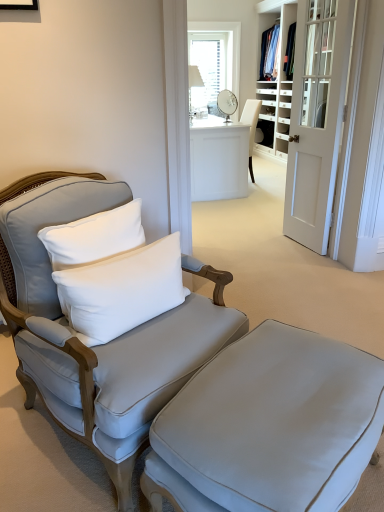
Find the location of `satin gray armchair at left`. satin gray armchair at left is located at coordinates (95, 345).

The width and height of the screenshot is (384, 512). Describe the element at coordinates (231, 42) in the screenshot. I see `white glass window at upper center` at that location.

This screenshot has width=384, height=512. Identify the location of matte gray ottoman at lower center. (269, 426).

Which is closer, (302, 80) or (191, 22)?

Point (302, 80) is closer to the camera than point (191, 22).

Is white wood door at right to the right of white glass window at upper center from the viewer's perspective?

Yes.

Is white wood door at right inside the boundaries of white glass window at upper center, or outside?

white wood door at right exists outside the volume of white glass window at upper center.

In the scene shown: From the image's perspective, is white wood door at right positioned above or below white glass window at upper center?

white wood door at right is below white glass window at upper center.

Considering the points (328, 156) and (130, 293), which point is in front, point (328, 156) or point (130, 293)?

Point (130, 293)

Is white soft cushion at left at the back of white wood door at right?

white wood door at right is not turned away from white soft cushion at left.

Who is more distant, white wood door at right or white soft cushion at left?

Positioned behind is white wood door at right.

Can you tell me how much white wood bookshelf at center and white glass window at upper center differ in facing direction?

The facing directions of white wood bookshelf at center and white glass window at upper center are 88.7 degrees apart.

In the image, is white wood bookshelf at center positioned in front of or behind white glass window at upper center?

Clearly, white wood bookshelf at center is in front of white glass window at upper center.

Is white wood bookshelf at center outside of white glass window at upper center?

white wood bookshelf at center is positioned outside white glass window at upper center.

Which of these two, white glossy desk at center or white soft cushion at left, stands taller?

Standing taller between the two is white glossy desk at center.

What's the angular difference between white glossy desk at center and white soft cushion at left's facing directions?

31.3 degrees.

Is point (235, 123) closer or farther from the camera than point (116, 328)?

Point (235, 123) is farther from the camera than point (116, 328).

Is white soft cushion at left located within white glossy desk at center?

No, white glossy desk at center does not contain white soft cushion at left.

Does satin gray armchair at left lie behind white glass window at upper center?

That is False.

Measure the distance between satin gray armchair at left and white glass window at upper center.

They are 4.14 meters apart.

Based on the photo, how different are the orientations of satin gray armchair at left and white glass window at upper center in degrees?

There is a 35.7-degree angle between the facing directions of satin gray armchair at left and white glass window at upper center.

Is satin gray armchair at left turned away from white glass window at upper center?

satin gray armchair at left is not turned away from white glass window at upper center.

Can we say white glossy desk at center lies outside white wood bookshelf at center?

Yes.

From the image's perspective, which is above, white glossy desk at center or white wood bookshelf at center?

From the image's view, white wood bookshelf at center is above.

Which is behind, white glossy desk at center or white wood bookshelf at center?

white wood bookshelf at center is behind.

Is point (248, 133) positioned in front of point (259, 146)?

Yes, it is in front of point (259, 146).

Considering the sizes of objects matte gray ottoman at lower center and satin gray armchair at left in the image provided, who is shorter, matte gray ottoman at lower center or satin gray armchair at left?

With less height is matte gray ottoman at lower center.

Is matte gray ottoman at lower center far from satin gray armchair at left?

No, matte gray ottoman at lower center is in close proximity to satin gray armchair at left.

What's the angular difference between matte gray ottoman at lower center and satin gray armchair at left's facing directions?

They differ by 177 degrees in their facing directions.

Is matte gray ottoman at lower center inside the boundaries of satin gray armchair at left, or outside?

matte gray ottoman at lower center exists outside the volume of satin gray armchair at left.

Locate an element on the screen. The height and width of the screenshot is (512, 384). door in front of the white glass window at upper center is located at coordinates (316, 118).

The width and height of the screenshot is (384, 512). What are the coordinates of `pillow on the left side of white wood door at right` in the screenshot? It's located at tap(123, 289).

Estimate the real-world distances between objects in this image. Which object is closer to white wood bookshelf at center, white glass window at upper center or white wood door at right?

Based on the image, white glass window at upper center appears to be nearer to white wood bookshelf at center.

Based on their spatial positions, is white wood door at right or matte gray ottoman at lower center closer to white soft cushion at left?

matte gray ottoman at lower center is positioned closer to the anchor white soft cushion at left.

Estimate the real-world distances between objects in this image. Which object is further from matte gray ottoman at lower center, white wood bookshelf at center or white soft cushion at left?

white wood bookshelf at center is positioned further to the anchor matte gray ottoman at lower center.

Which object lies nearer to the anchor point white glass window at upper center, white glossy desk at center or white wood door at right?

Based on the image, white glossy desk at center appears to be nearer to white glass window at upper center.

Estimate the real-world distances between objects in this image. Which object is closer to satin gray armchair at left, white wood door at right or white glossy desk at center?

white wood door at right.

Estimate the real-world distances between objects in this image. Which object is further from matte gray ottoman at lower center, white wood door at right or white glossy desk at center?

white glossy desk at center is further to matte gray ottoman at lower center.

Based on their spatial positions, is white wood bookshelf at center or white soft cushion at left closer to white glass window at upper center?

Based on the image, white wood bookshelf at center appears to be nearer to white glass window at upper center.

From the image, which object appears to be farther from white wood door at right, white soft cushion at left or matte gray ottoman at lower center?

matte gray ottoman at lower center is positioned further to the anchor white wood door at right.

At what (x,y) coordinates should I click in order to perform the action: click on desk between white wood door at right and white wood bookshelf at center in the front-back direction. Please return your answer as a coordinate pair (x, y). This screenshot has height=512, width=384. Looking at the image, I should click on (219, 159).

Where is `chair located between matte gray ottoman at lower center and white glossy desk at center in the depth direction`? chair located between matte gray ottoman at lower center and white glossy desk at center in the depth direction is located at coordinates (95, 345).

You are a GUI agent. You are given a task and a screenshot of the screen. Output one action in this format:
    pyautogui.click(x=<x>, y=<y>)
    Task: Click on the door between satin gray armchair at left and white glass window at upper center from front to back
    The height and width of the screenshot is (512, 384).
    Given the screenshot: What is the action you would take?
    pyautogui.click(x=316, y=118)

Where is `desk positioned between satin gray armchair at left and white glass window at upper center from near to far`? desk positioned between satin gray armchair at left and white glass window at upper center from near to far is located at coordinates (219, 159).